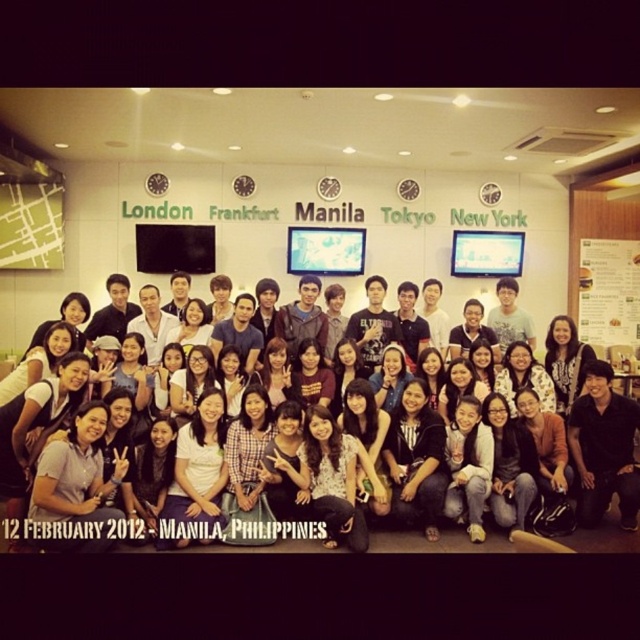
Between white fabric shirt at center and white paper menu at right, which one has more height?

Standing taller between the two is white paper menu at right.

Is white fabric shirt at center wider than white paper menu at right?

Indeed, white fabric shirt at center has a greater width compared to white paper menu at right.

Between point (449, 536) and point (625, 340), which one is positioned behind?

Positioned behind is point (625, 340).

Where is `white fabric shirt at center`? white fabric shirt at center is located at coordinates (509, 540).